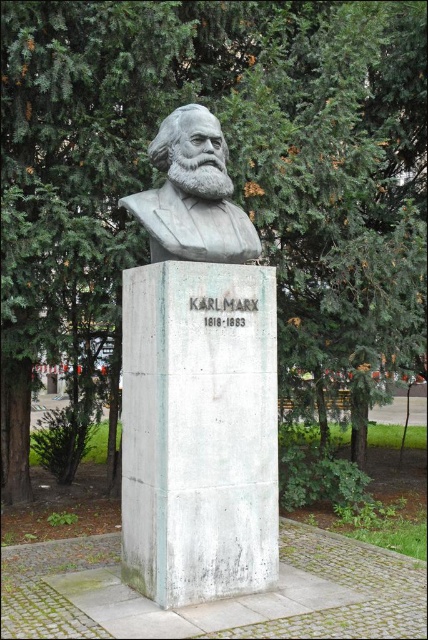
Question: Is white marble bust at center wider than gray polished bust at center?

Choices:
 (A) yes
 (B) no

Answer: (A)

Question: Which point is farther from the camera taking this photo?

Choices:
 (A) (158, 209)
 (B) (180, 596)

Answer: (A)

Question: Which object is closer to the camera taking this photo?

Choices:
 (A) white marble bust at center
 (B) gray polished bust at center

Answer: (A)

Question: Can you confirm if white marble bust at center is smaller than gray polished bust at center?

Choices:
 (A) yes
 (B) no

Answer: (B)

Question: Can you confirm if white marble bust at center is wider than gray polished bust at center?

Choices:
 (A) yes
 (B) no

Answer: (A)